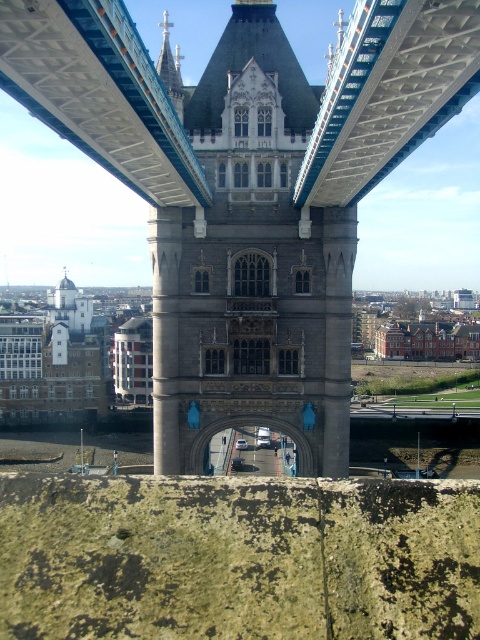
You are standing at the base of Tower Bridge and want to take a photo of the stone archway at center. According to the scene description, where should you position yourself to capture the archway in the center of your frame?

The stone archway at center is located at point (247, 192), so you should position yourself directly in front of the stone archway at center to ensure it is centered in your photo.

From the picture: You are standing at the base of Tower Bridge and looking up at the tower. You notice two points marked on the tower wall. The first point is at coordinates point (26, 90) and the second is at point (188, 472). From your perspective, which point appears closer to you?

Point (26, 90) is in front of point (188, 472), so it appears closer to you.

Based on the photo, you are a tour guide explaining the architecture of Tower Bridge to visitors. You point out the stone archway at center and the stone gothic arch at center. You mention their proximity. How far apart are they?

The stone archway at center is 7.21 feet from the stone gothic arch at center.